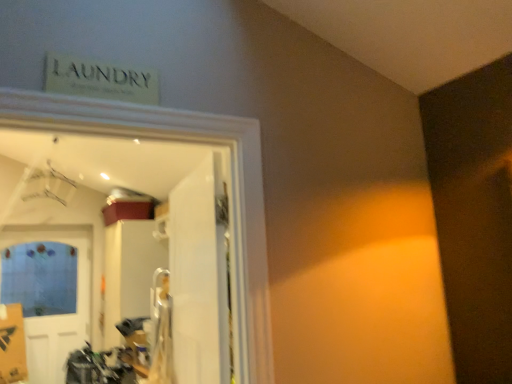
Question: Considering the relative sizes of blue matte door at lower left, which is the 1th door in back-to-front order, and white glossy door at center, which is the first door in front-to-back order, in the image provided, is blue matte door at lower left, which is the 1th door in back-to-front order, smaller than white glossy door at center, which is the first door in front-to-back order,?

Choices:
 (A) no
 (B) yes

Answer: (A)

Question: Could white glossy door at center, which is the second door from left to right, be considered to be inside blue matte door at lower left, which is the 2th door from right to left?

Choices:
 (A) no
 (B) yes

Answer: (A)

Question: From the image's perspective, is blue matte door at lower left, which is the 1th door in back-to-front order, beneath white glossy door at center, positioned as the first door in right-to-left order?

Choices:
 (A) yes
 (B) no

Answer: (A)

Question: Is blue matte door at lower left, which is the 1th door in back-to-front order, not close to white glossy door at center, which is the second door from left to right?

Choices:
 (A) yes
 (B) no

Answer: (A)

Question: From a real-world perspective, is blue matte door at lower left, which is the 2th door from right to left, below white glossy door at center, positioned as the first door in right-to-left order?

Choices:
 (A) yes
 (B) no

Answer: (A)

Question: Is blue matte door at lower left, the first door in the left-to-right sequence, directly adjacent to white glossy door at center, which is the second door from left to right?

Choices:
 (A) no
 (B) yes

Answer: (A)

Question: Does white glossy door at center, which is the second door from left to right, have a greater width compared to blue matte door at lower left, which ranks as the second door in front-to-back order?

Choices:
 (A) no
 (B) yes

Answer: (B)

Question: From a real-world perspective, is white glossy door at center, positioned as the first door in right-to-left order, positioned over blue matte door at lower left, which ranks as the second door in front-to-back order, based on gravity?

Choices:
 (A) no
 (B) yes

Answer: (B)

Question: Can you confirm if white glossy door at center, which is the first door in front-to-back order, is bigger than blue matte door at lower left, the first door in the left-to-right sequence?

Choices:
 (A) yes
 (B) no

Answer: (B)

Question: Is white glossy door at center, positioned as the first door in right-to-left order, facing away from blue matte door at lower left, which is the 2th door from right to left?

Choices:
 (A) yes
 (B) no

Answer: (B)

Question: Is white glossy door at center, which is the second door in back-to-front order, aimed at blue matte door at lower left, which is the 2th door from right to left?

Choices:
 (A) yes
 (B) no

Answer: (B)

Question: Does white glossy door at center, which is the first door in front-to-back order, lie in front of blue matte door at lower left, the first door in the left-to-right sequence?

Choices:
 (A) no
 (B) yes

Answer: (B)

Question: In the image, is white glossy door at center, positioned as the first door in right-to-left order, on the left side or the right side of blue matte door at lower left, which ranks as the second door in front-to-back order?

Choices:
 (A) right
 (B) left

Answer: (A)